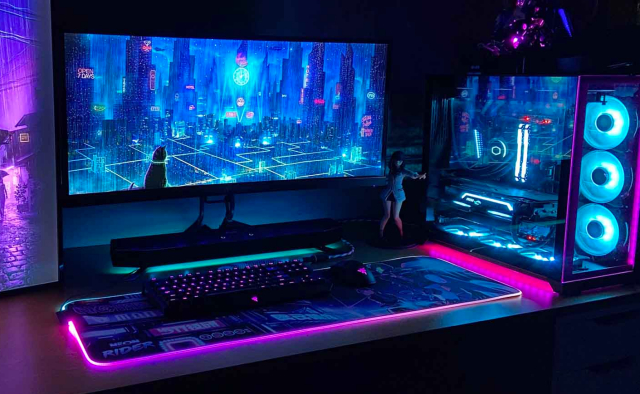
The width and height of the screenshot is (640, 394). In order to click on computer monitors in this screenshot , I will do `click(32, 220)`, `click(257, 134)`.